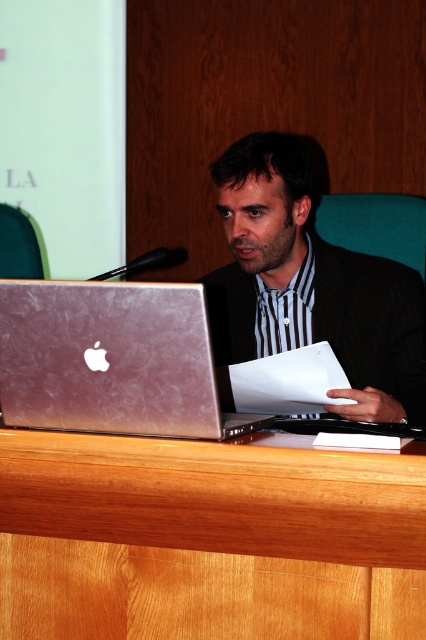
Question: Does silver metallic laptop at center have a larger size compared to green fabric chair at left?

Choices:
 (A) yes
 (B) no

Answer: (A)

Question: Which point is farther to the camera?

Choices:
 (A) green fabric chair at left
 (B) silver metallic laptop at center
 (C) matte black suit at center
 (D) teal fabric chair at center

Answer: (A)

Question: Based on their relative distances, which object is farther from the silver metallic laptop at center?

Choices:
 (A) teal fabric chair at center
 (B) green fabric chair at left
 (C) wooden table at center

Answer: (B)

Question: Which of the following is the farthest from the observer?

Choices:
 (A) teal fabric chair at center
 (B) matte black suit at center
 (C) wooden table at center

Answer: (A)

Question: Does silver metallic laptop at center lie behind green fabric chair at left?

Choices:
 (A) no
 (B) yes

Answer: (A)

Question: Can you confirm if matte black suit at center is positioned to the right of green fabric chair at left?

Choices:
 (A) yes
 (B) no

Answer: (A)